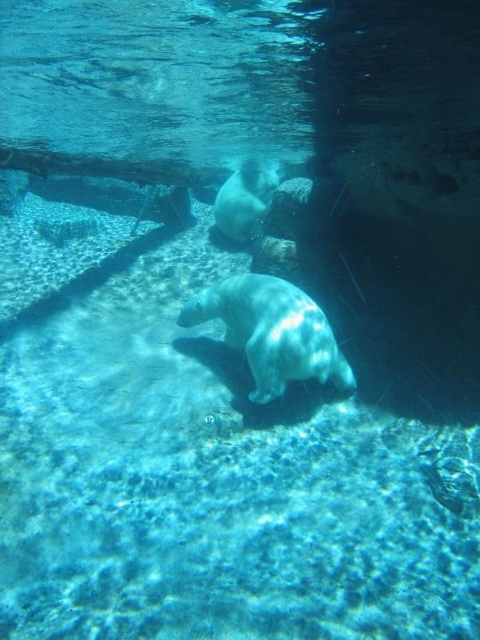
Question: Is white smooth seal at center wider than white smooth seal at upper center?

Choices:
 (A) yes
 (B) no

Answer: (A)

Question: Which point is closer to the camera taking this photo?

Choices:
 (A) pos(250,160)
 (B) pos(186,307)

Answer: (B)

Question: Does white smooth seal at center lie behind white smooth seal at upper center?

Choices:
 (A) no
 (B) yes

Answer: (A)

Question: Is white smooth seal at center smaller than white smooth seal at upper center?

Choices:
 (A) yes
 (B) no

Answer: (B)